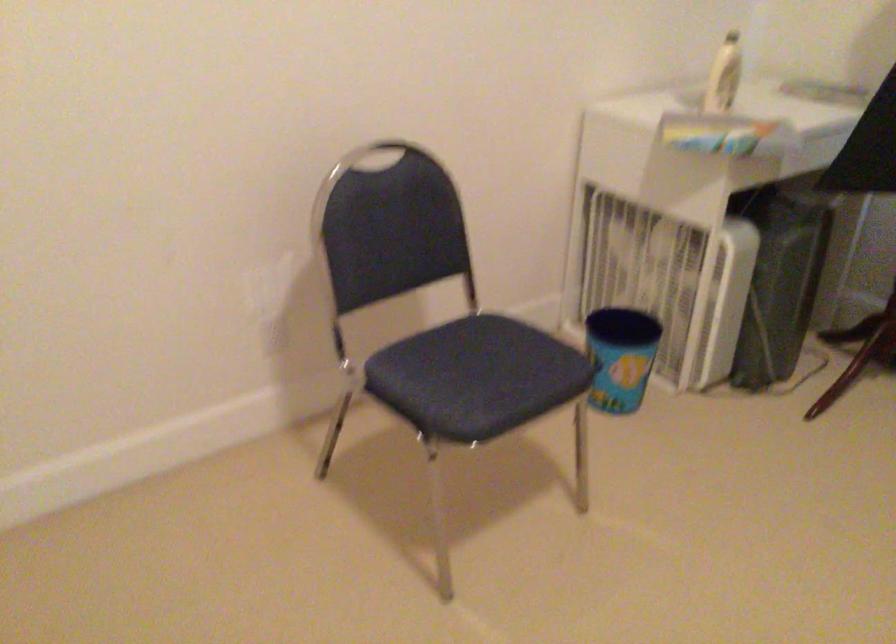
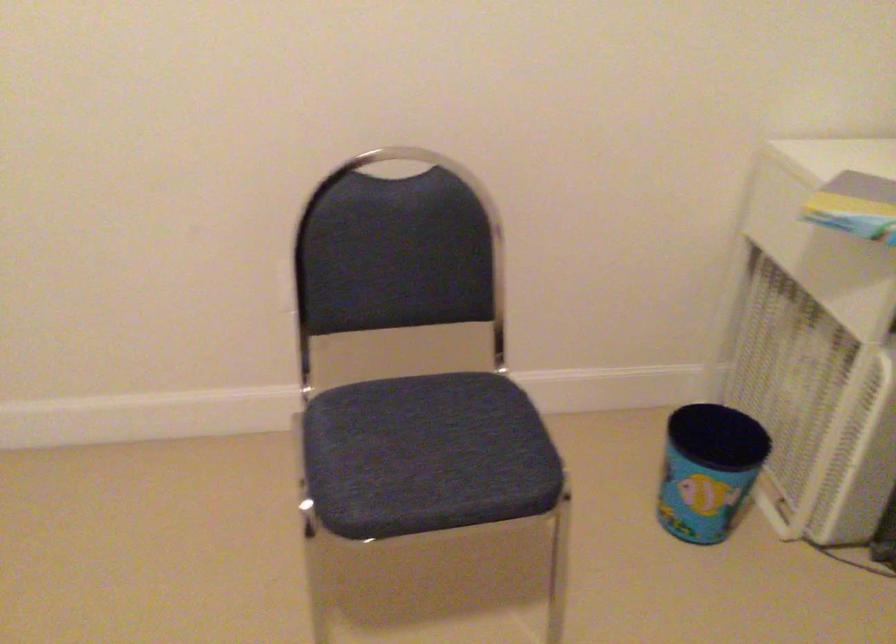
In the second image, find the point that corresponds to point (478, 377) in the first image.

(426, 455)